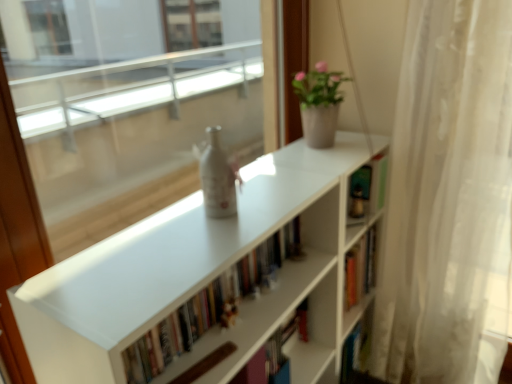
The height and width of the screenshot is (384, 512). Identify the location of unoccupied area in front of matte white pot at upper right. (327, 159).